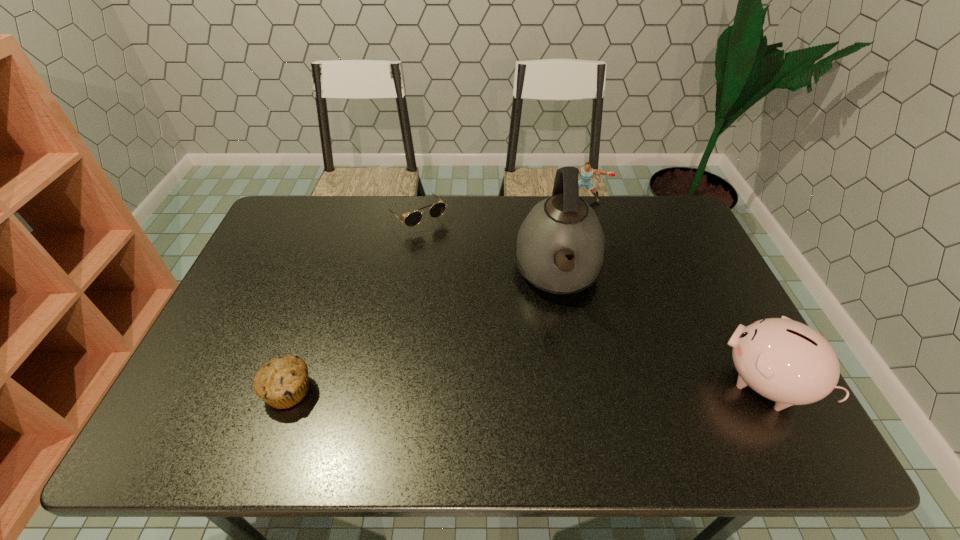
Find the location of a particular element. The image size is (960, 540). puncher that is at the far edge is located at coordinates (586, 172).

You are a GUI agent. You are given a task and a screenshot of the screen. Output one action in this format:
    pyautogui.click(x=<x>, y=<y>)
    Task: Click on the muffin that is at the near edge
    
    Given the screenshot: What is the action you would take?
    pyautogui.click(x=282, y=382)

What are the coordinates of `piggy bank at the near edge` in the screenshot? It's located at (783, 360).

At what (x,y) coordinates should I click in order to perform the action: click on object that is at the right edge. Please return your answer as a coordinate pair (x, y). Looking at the image, I should click on (783, 360).

The width and height of the screenshot is (960, 540). I want to click on object at the near right corner, so click(783, 360).

Identify the location of vacant space at the far edge of the desktop. The image size is (960, 540). (343, 226).

Where is `free space at the near edge of the desktop`? The width and height of the screenshot is (960, 540). free space at the near edge of the desktop is located at coordinates (472, 398).

Find the location of `free region at the left edge of the desktop`. free region at the left edge of the desktop is located at coordinates (261, 320).

Image resolution: width=960 pixels, height=540 pixels. What are the coordinates of `vacant region at the right edge of the desktop` in the screenshot? It's located at (714, 299).

In the image, there is a desktop. Where is `vacant space at the far right corner`? vacant space at the far right corner is located at coordinates (648, 215).